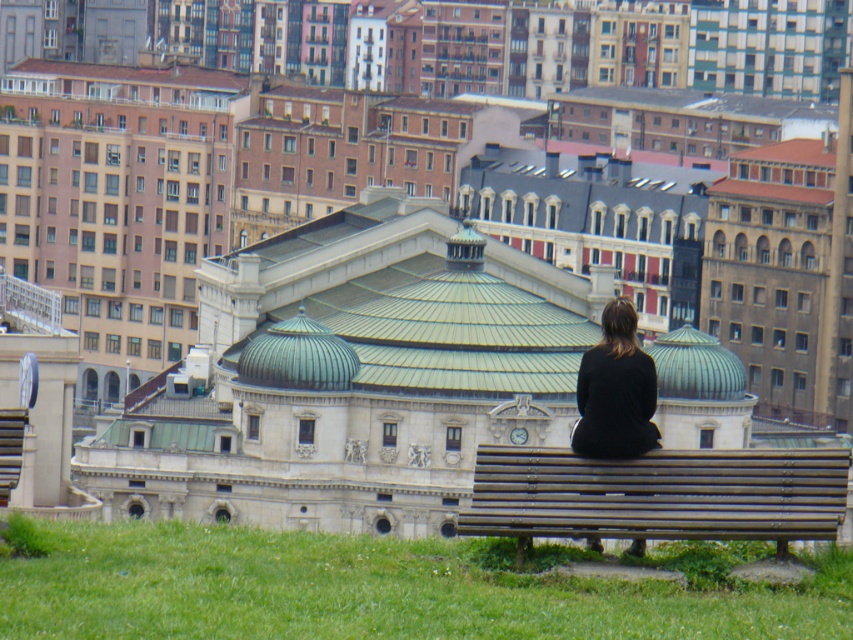
Does brown wooden bench at lower right have a larger size compared to black matte dress at lower right?

Indeed, brown wooden bench at lower right has a larger size compared to black matte dress at lower right.

Can you confirm if brown wooden bench at lower right is smaller than black matte dress at lower right?

Actually, brown wooden bench at lower right might be larger than black matte dress at lower right.

The height and width of the screenshot is (640, 853). I want to click on brown wooden bench at lower right, so click(x=657, y=496).